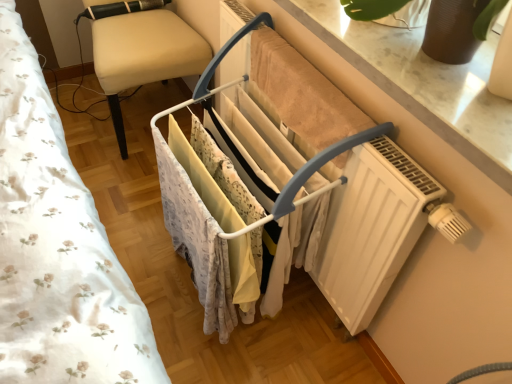
Question: Would you say white floral fabric at left is inside or outside white matte clothes rack at center?

Choices:
 (A) inside
 (B) outside

Answer: (B)

Question: Is white floral fabric at left in front of or behind white matte clothes rack at center in the image?

Choices:
 (A) front
 (B) behind

Answer: (A)

Question: Which object is the closest to the beige fabric chair at left?

Choices:
 (A) white matte clothes rack at center
 (B) white floral fabric at left

Answer: (B)

Question: Estimate the real-world distances between objects in this image. Which object is farther from the beige fabric chair at left?

Choices:
 (A) white matte clothes rack at center
 (B) white floral fabric at left

Answer: (A)